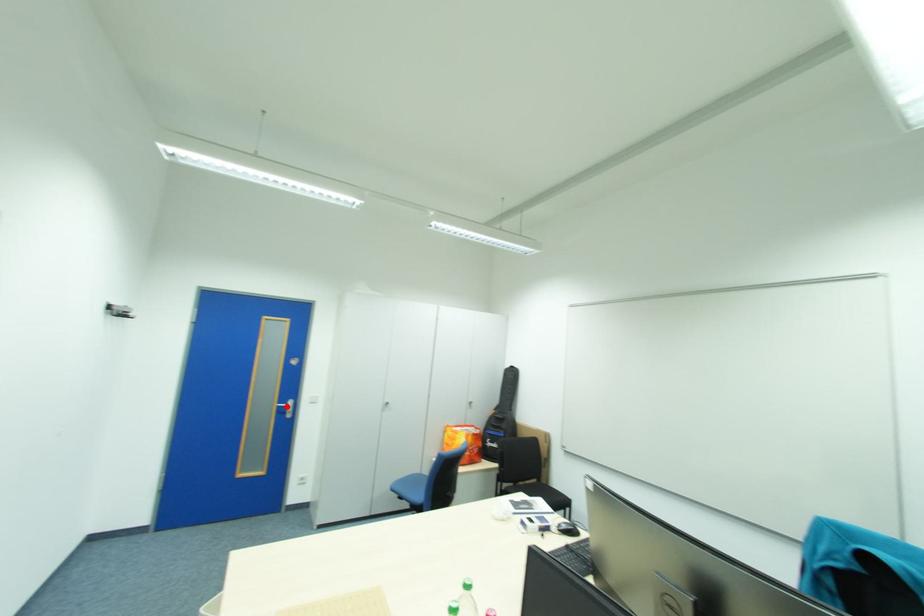
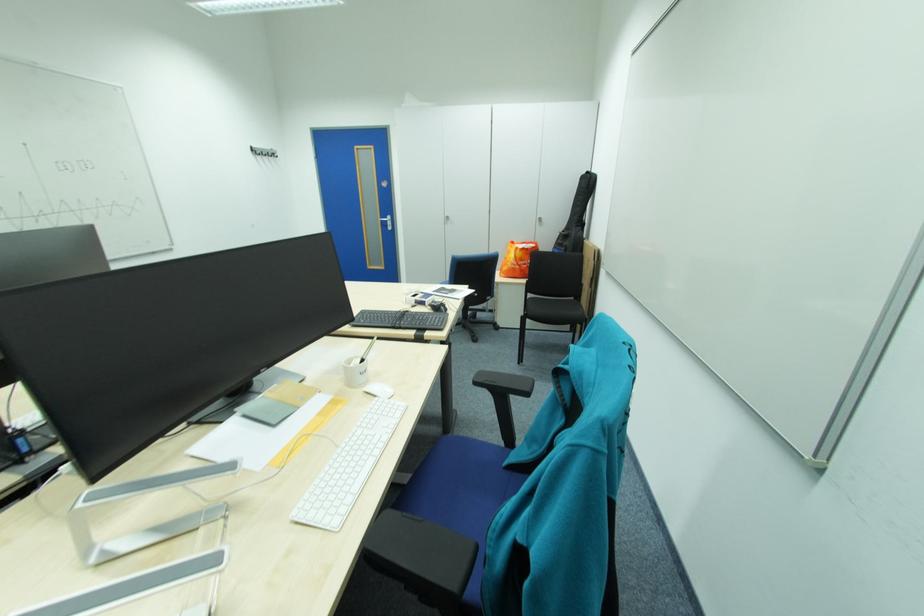
The point at the highlighted location is marked in the first image. Where is the corresponding point in the second image?

(390, 221)